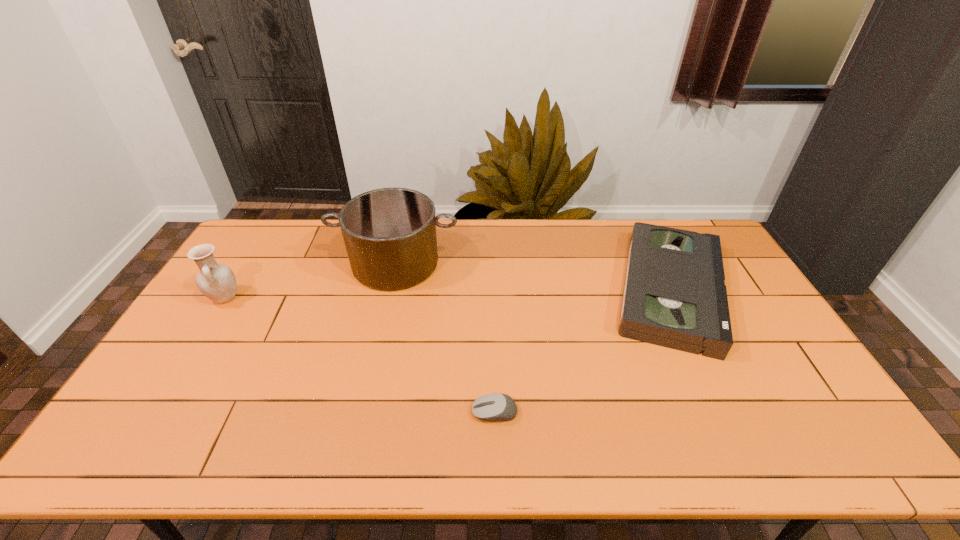
Identify the location of vacant space located on the wheel side of the nearest object. The width and height of the screenshot is (960, 540). (416, 412).

I want to click on free space located on the wheel side of the nearest object, so click(392, 412).

Where is `pan present at the far edge`? Image resolution: width=960 pixels, height=540 pixels. pan present at the far edge is located at coordinates (390, 237).

Locate an element on the screen. The height and width of the screenshot is (540, 960). videotape that is at the far edge is located at coordinates (675, 296).

Identify the location of object that is positioned at the left edge. (217, 282).

You are a GUI agent. You are given a task and a screenshot of the screen. Output one action in this format:
    pyautogui.click(x=<x>, y=<y>)
    Task: Click on the object at the right edge
    
    Given the screenshot: What is the action you would take?
    pyautogui.click(x=675, y=296)

At what (x,y) coordinates should I click in order to perform the action: click on object at the far right corner. Please return your answer as a coordinate pair (x, y). The image size is (960, 540). Looking at the image, I should click on (x=675, y=296).

The width and height of the screenshot is (960, 540). I want to click on free space at the far edge, so click(453, 227).

You are a GUI agent. You are given a task and a screenshot of the screen. Output one action in this format:
    pyautogui.click(x=<x>, y=<y>)
    Task: Click on the free region at the near edge
    The height and width of the screenshot is (540, 960).
    Given the screenshot: What is the action you would take?
    pyautogui.click(x=242, y=444)

In the image, there is a desktop. At what (x,y) coordinates should I click in order to perform the action: click on vacant region at the far left corner. Please return your answer as a coordinate pair (x, y). The image size is (960, 540). Looking at the image, I should click on (235, 256).